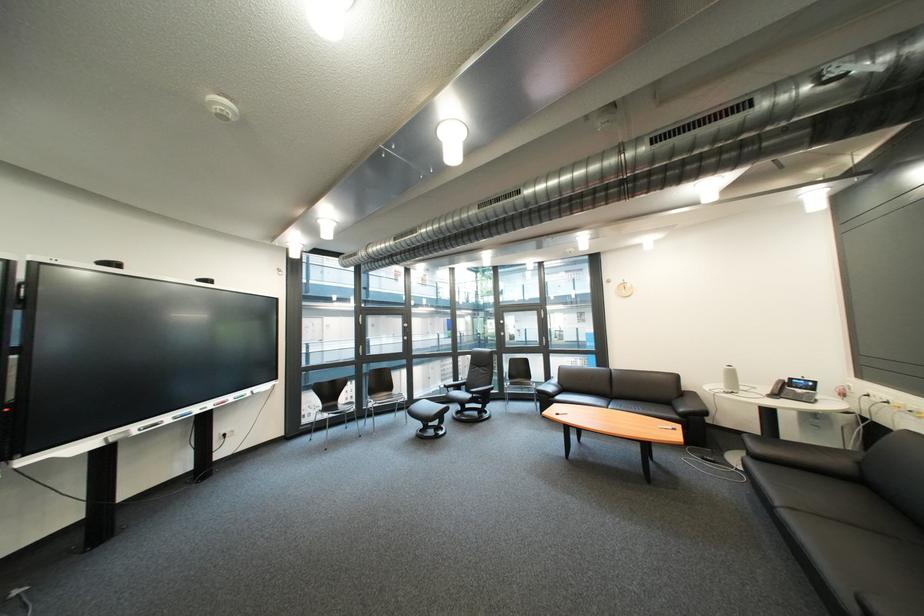
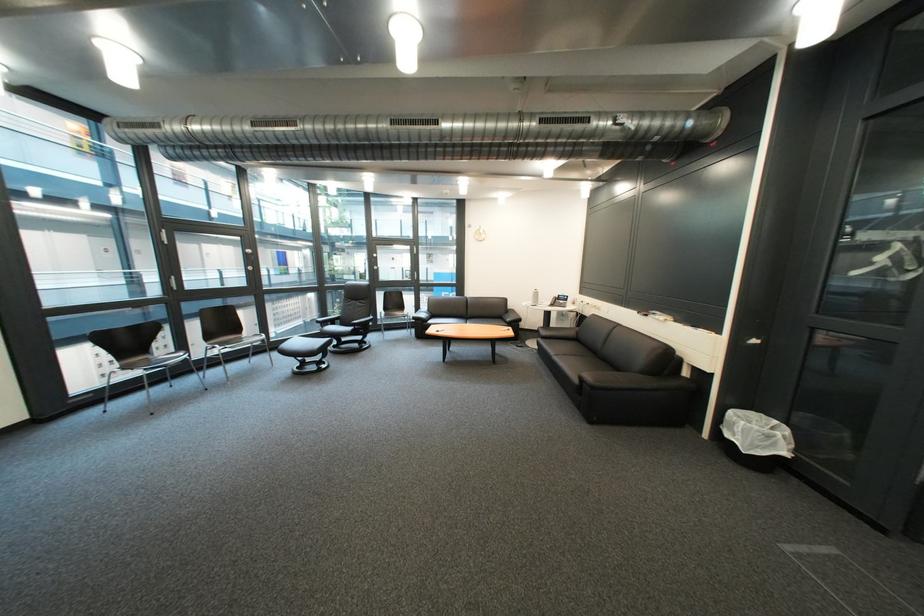
The point at (483, 400) is marked in the first image. Where is the corresponding point in the second image?

(366, 331)